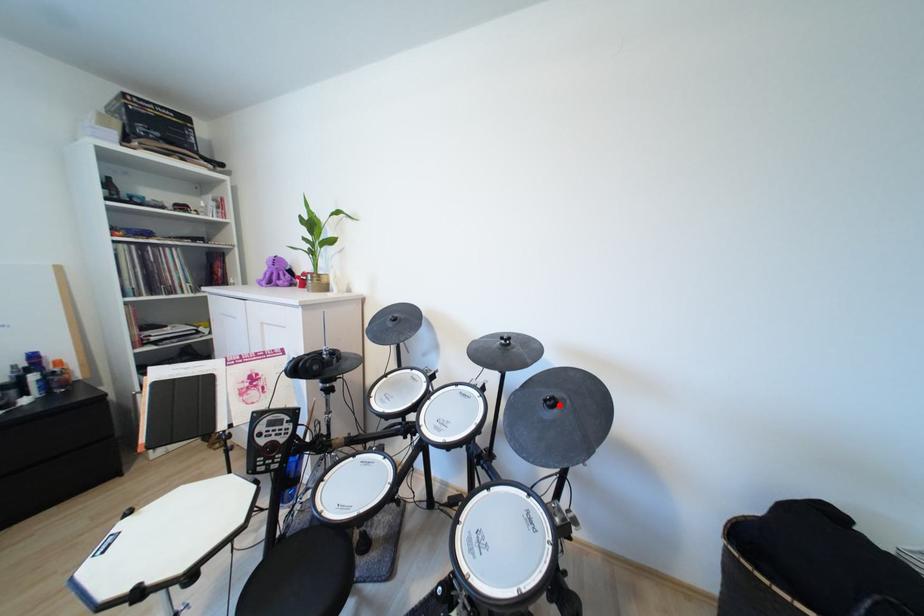
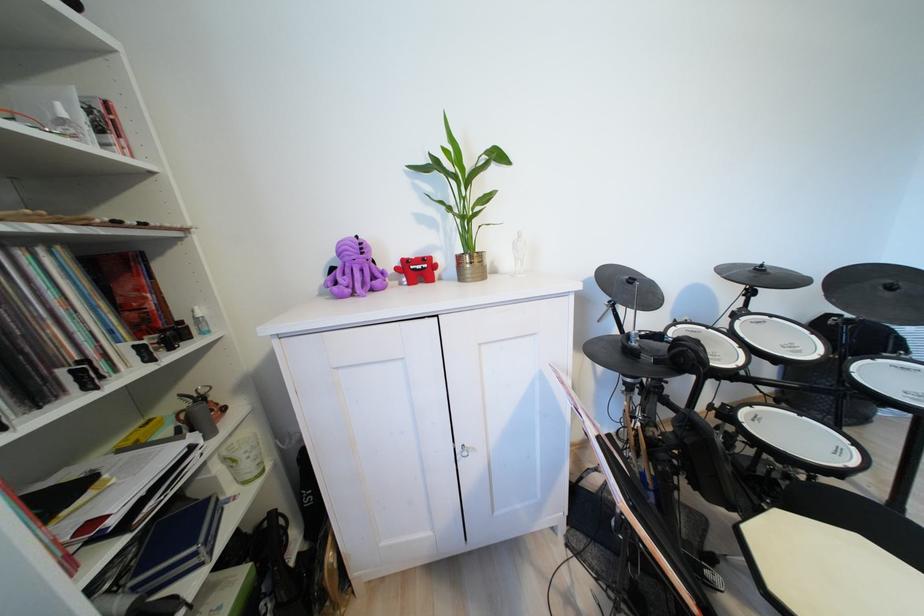
Where in the second image is the point corresponding to the highlighted location from the first image?

(897, 289)